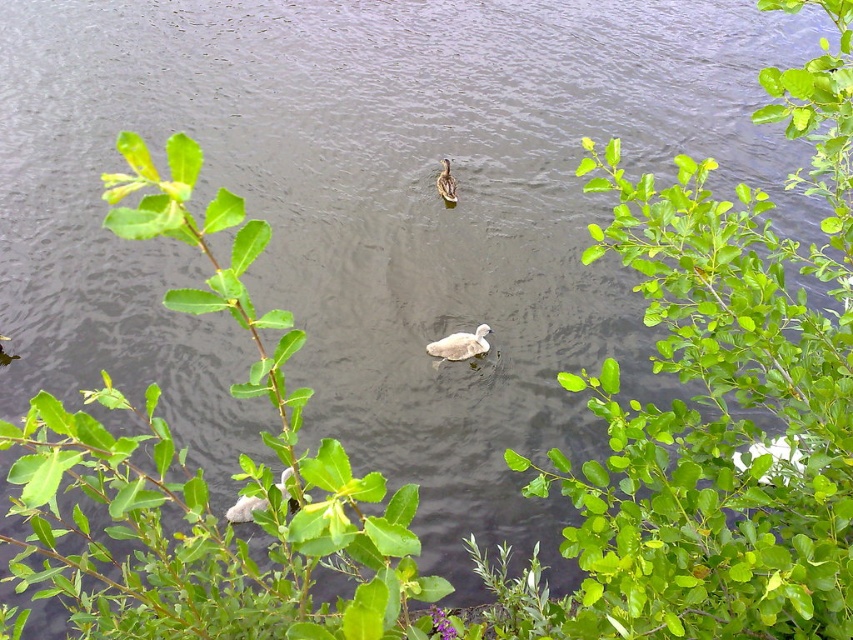
Who is more distant from viewer, (210, 604) or (444, 173)?

Positioned behind is point (444, 173).

Does green leafy plant at center appear under brown feathered duck at center?

Indeed, green leafy plant at center is positioned under brown feathered duck at center.

You are a GUI agent. You are given a task and a screenshot of the screen. Output one action in this format:
    pyautogui.click(x=<x>, y=<y>)
    Task: Click on the green leafy plant at center
    
    Given the screenshot: What is the action you would take?
    pyautogui.click(x=204, y=480)

Can you confirm if white fluffy swan at center is bigger than brown feathered duck at center?

No.

This screenshot has width=853, height=640. What do you see at coordinates (460, 344) in the screenshot?
I see `white fluffy swan at center` at bounding box center [460, 344].

The image size is (853, 640). Identify the location of white fluffy swan at center. (460, 344).

Between point (242, 385) and point (450, 353), which one is positioned behind?

The point (450, 353) is behind.

Who is more forward, (305, 544) or (444, 340)?

Point (305, 544) is more forward.

Does point (241, 593) come closer to viewer compared to point (467, 346)?

Yes, point (241, 593) is closer to viewer.

Locate an element on the screen. green leafy plant at center is located at coordinates (204, 480).